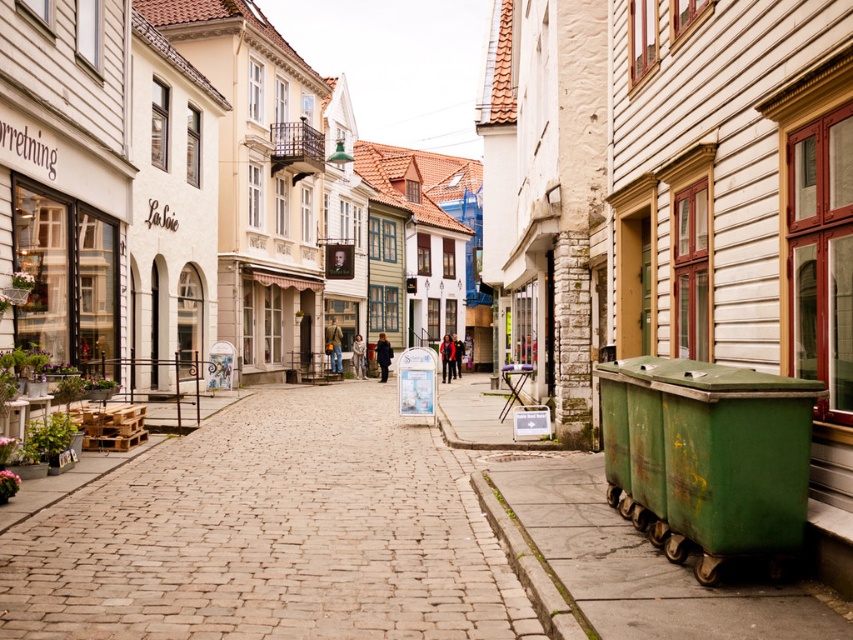
Question: Is brown cobblestone at center closer to camera compared to green metallic dumpster at lower right?

Choices:
 (A) yes
 (B) no

Answer: (B)

Question: Which object appears farthest from the camera in this image?

Choices:
 (A) brown cobblestone at center
 (B) green metallic dumpster at lower right

Answer: (A)

Question: Can you confirm if brown cobblestone at center is positioned above green metallic dumpster at lower right?

Choices:
 (A) no
 (B) yes

Answer: (A)

Question: Can you confirm if brown cobblestone at center is wider than green metallic dumpster at lower right?

Choices:
 (A) yes
 (B) no

Answer: (A)